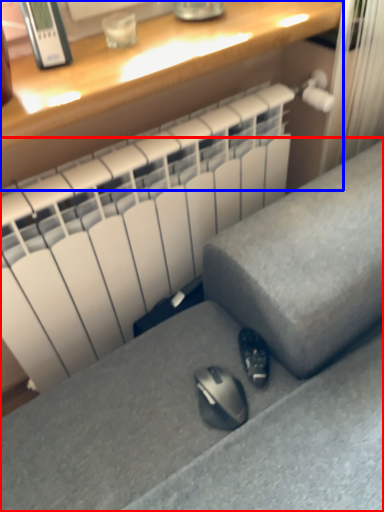
Question: Which object is further to the camera taking this photo, furniture (highlighted by a red box) or desk (highlighted by a blue box)?

Choices:
 (A) furniture
 (B) desk

Answer: (B)